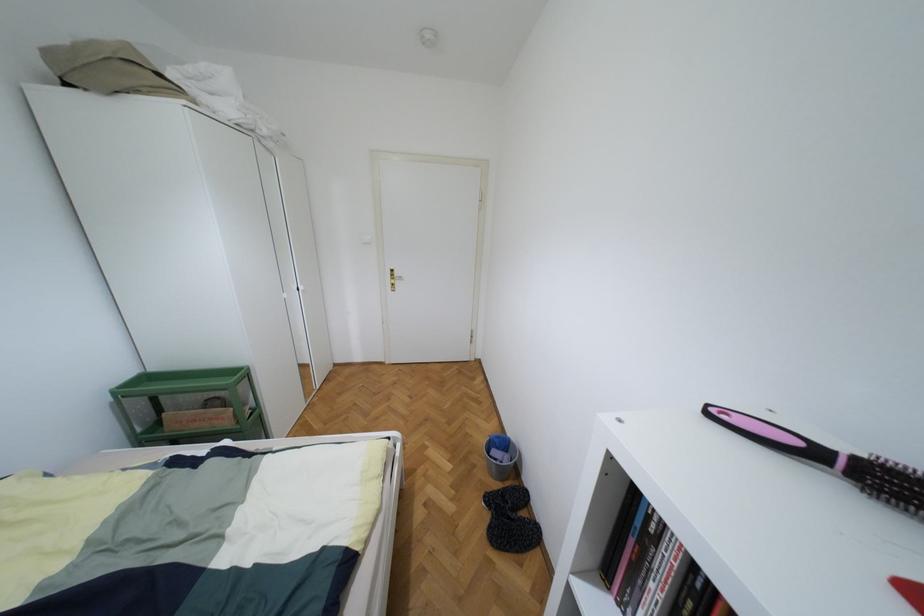
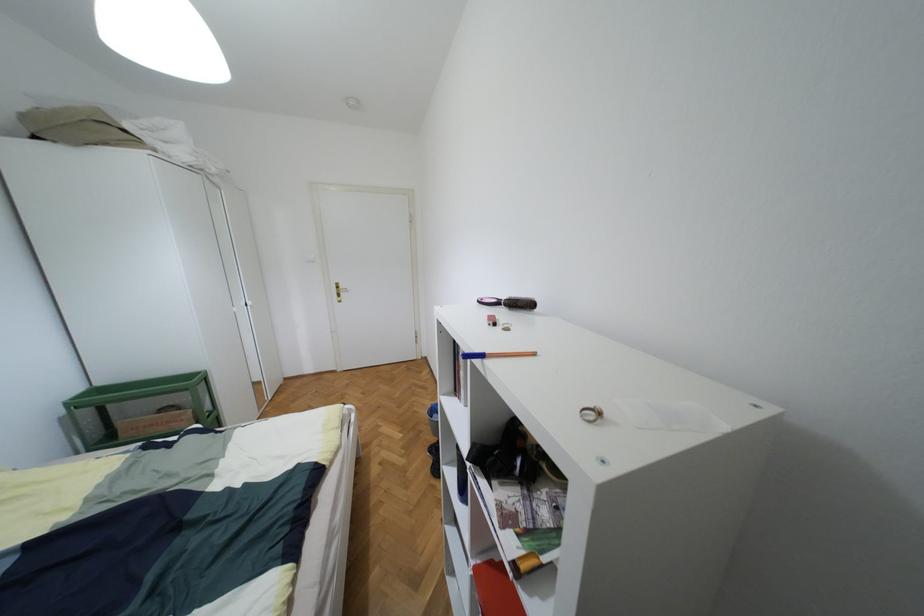
Question: The camera is either moving clockwise (left) or counter-clockwise (right) around the object. The first image is from the beginning of the video and the second image is from the end. Is the camera moving left or right when shooting the video?

Choices:
 (A) Left
 (B) Right

Answer: (A)